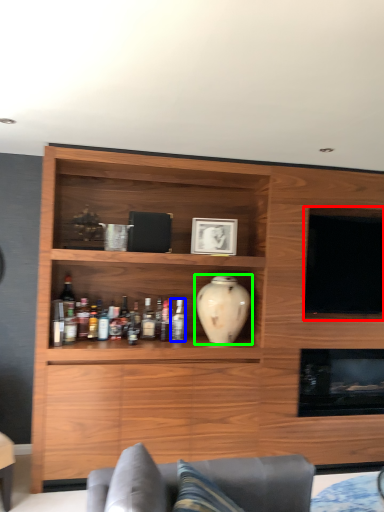
Question: Which is farther away from television (highlighted by a red box)? bottle (highlighted by a blue box) or vase (highlighted by a green box)?

Choices:
 (A) bottle
 (B) vase

Answer: (A)